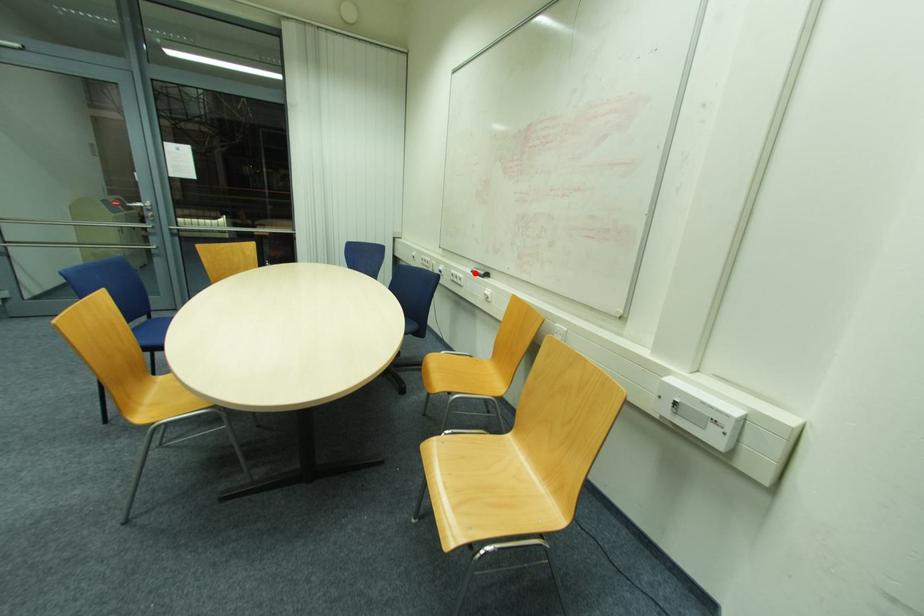
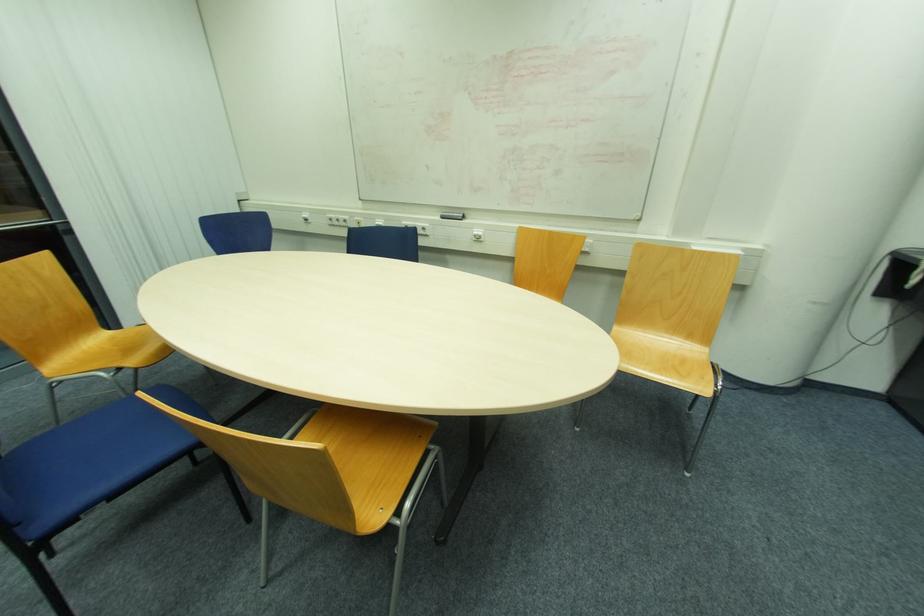
Find the pixel in the second image that matches the highlighted location in the first image.

(444, 217)